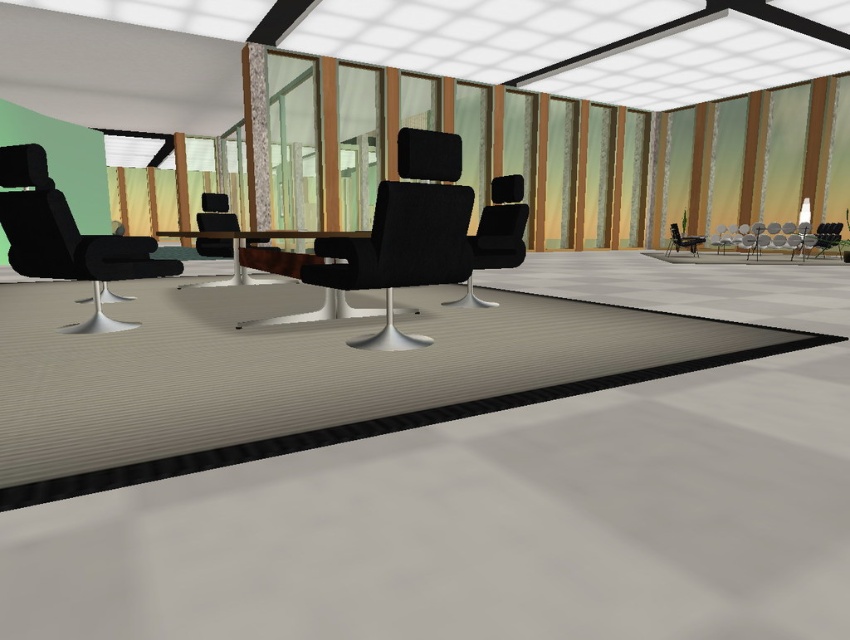
Which is more to the left, matte black chair at left or matte black chair at center?

Positioned to the left is matte black chair at left.

Between point (44, 179) and point (482, 264), which one is positioned behind?

Positioned behind is point (482, 264).

Does point (35, 170) come behind point (490, 236)?

No, it is not.

Identify the location of matte black chair at left. (66, 237).

Is point (463, 362) farther from camera compared to point (479, 307)?

No, (463, 362) is in front of (479, 307).

At what (x,y) coordinates should I click in order to perform the action: click on textured gray mat at center. Please return your answer as a coordinate pair (x, y). The width and height of the screenshot is (850, 640). Looking at the image, I should click on (303, 380).

Does matte black swivel chair at center have a lesser width compared to matte black chair at right?

No, matte black swivel chair at center is not thinner than matte black chair at right.

Who is higher up, matte black swivel chair at center or matte black chair at right?

Positioned higher is matte black chair at right.

Who is more distant from viewer, (406,172) or (672,225)?

Point (672,225)

Locate an element on the screen. The width and height of the screenshot is (850, 640). matte black swivel chair at center is located at coordinates (394, 237).